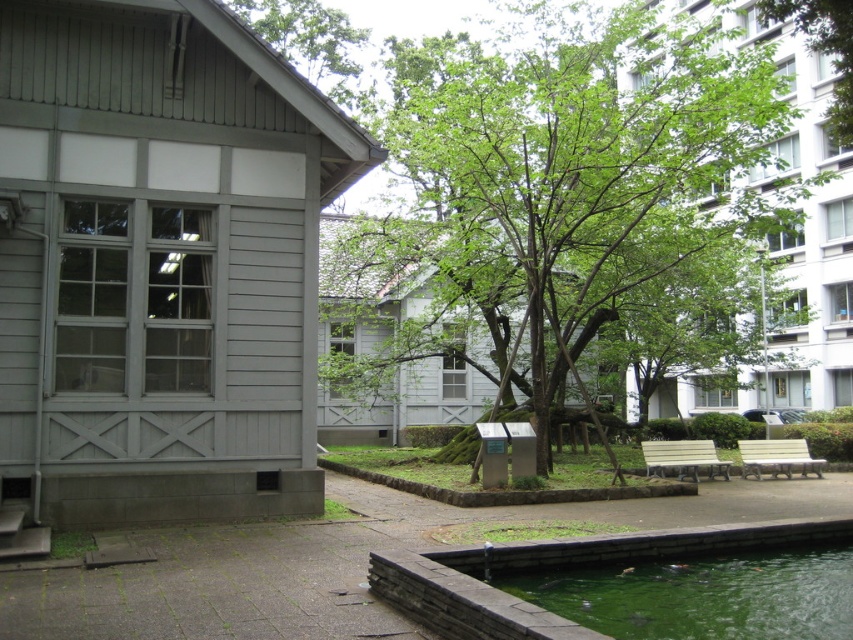
Between point (433, 237) and point (757, 465), which one is positioned behind?

Positioned behind is point (433, 237).

How distant is green leafy tree at center from light beige wooden bench at lower right?

green leafy tree at center and light beige wooden bench at lower right are 34.60 feet apart from each other.

Locate an element on the screen. The height and width of the screenshot is (640, 853). green leafy tree at center is located at coordinates (572, 192).

Is green leafy tree at center to the right of green concrete pool at lower center from the viewer's perspective?

Yes, green leafy tree at center is to the right of green concrete pool at lower center.

Is green leafy tree at center shorter than green concrete pool at lower center?

No.

Find the location of a particular element. The width and height of the screenshot is (853, 640). green leafy tree at center is located at coordinates (572, 192).

Can you confirm if green concrete pool at lower center is shorter than light brown wooden bench at lower right?

Yes.

Is point (494, 618) less distant than point (653, 461)?

That is True.

Where is `green concrete pool at lower center`? Image resolution: width=853 pixels, height=640 pixels. green concrete pool at lower center is located at coordinates (573, 566).